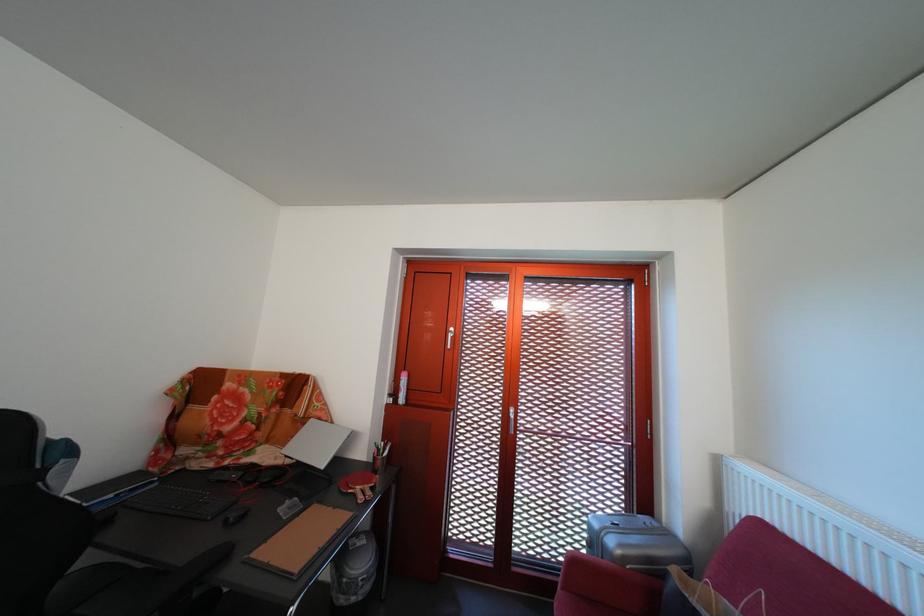
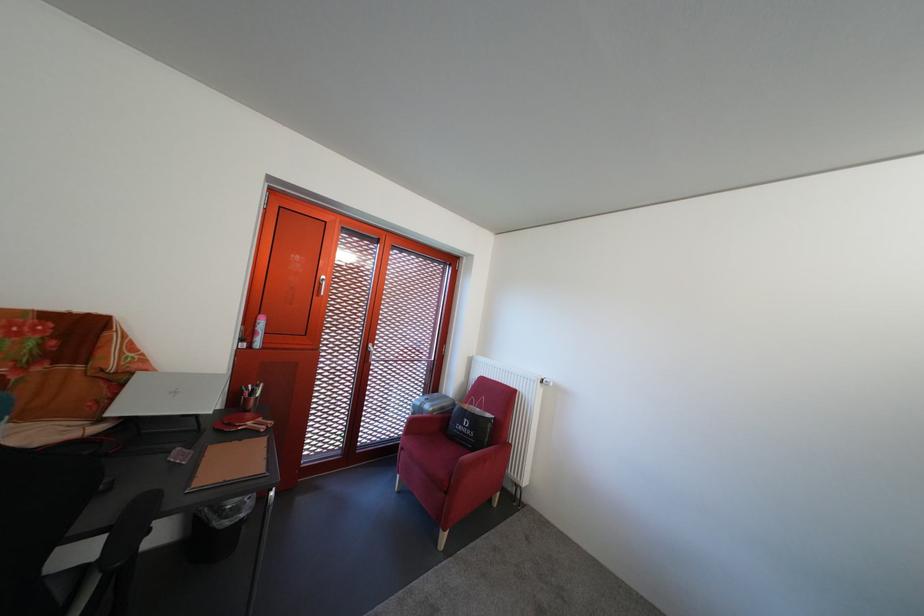
The point at (622, 549) is marked in the first image. Where is the corresponding point in the second image?

(439, 413)